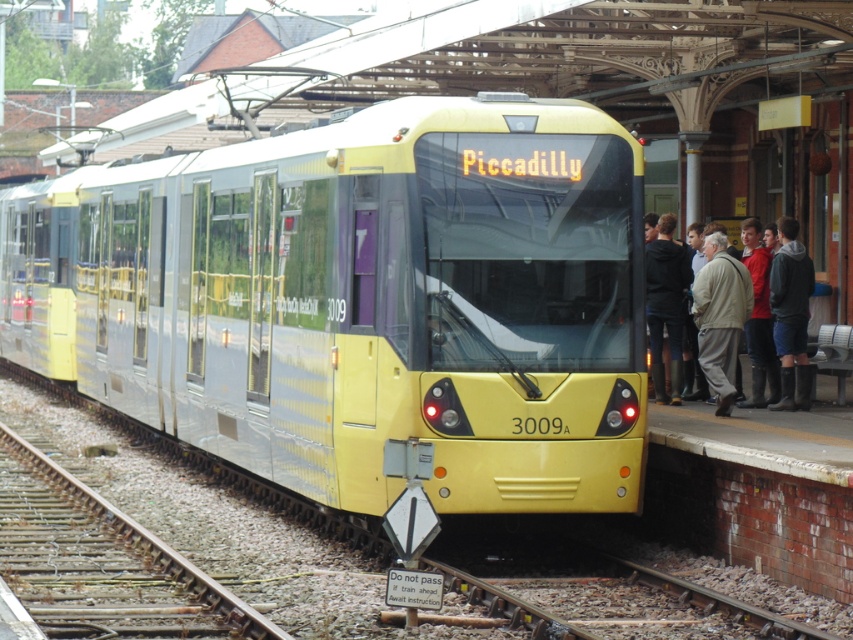
Question: Does yellow metallic train at center appear under light beige jacket at right?

Choices:
 (A) yes
 (B) no

Answer: (B)

Question: Can you confirm if yellow metallic train at center is thinner than light beige jacket at right?

Choices:
 (A) no
 (B) yes

Answer: (A)

Question: Which of the following is the closest to the observer?

Choices:
 (A) (26, 298)
 (B) (700, 340)

Answer: (B)

Question: Observing the image, what is the correct spatial positioning of yellow metallic train at center in reference to light beige jacket at right?

Choices:
 (A) right
 (B) left

Answer: (B)

Question: Which point appears closest to the camera in this image?

Choices:
 (A) (619, 182)
 (B) (727, 344)

Answer: (A)